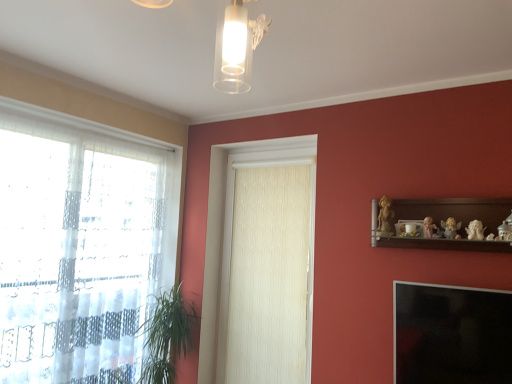
Question: Is transparent fabric at left in front of or behind white textured curtain at center in the image?

Choices:
 (A) behind
 (B) front

Answer: (B)

Question: Based on their sizes in the image, would you say transparent fabric at left is bigger or smaller than white textured curtain at center?

Choices:
 (A) small
 (B) big

Answer: (B)

Question: Estimate the real-world distances between objects in this image. Which object is closer to the matte gold angel at upper right, which appears as the 3th toy when viewed from the left?

Choices:
 (A) transparent fabric at left
 (B) wooden shelf at upper right
 (C) white textured curtain at center
 (D) transparent glass window screen at lower right
 (E) green leafy plant at lower left

Answer: (B)

Question: Which object is the farthest from the white textured curtain at center?

Choices:
 (A) matte white figurine at upper right, marked as the 4th toy in a right-to-left arrangement
 (B) white porcelain figurine at upper right, which ranks as the second toy in right-to-left order
 (C) wooden statue at upper right, placed as the first toy when sorted from left to right
 (D) porcelain figurine at upper right, which is the first toy in right-to-left order
 (E) green leafy plant at lower left

Answer: (D)